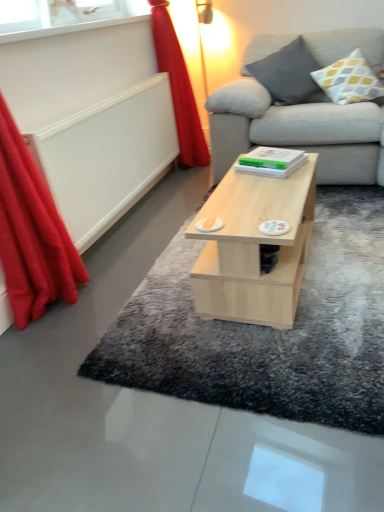
Identify the location of gray fabric pillow at upper right, the second pillow positioned from the right. (287, 73).

In order to click on transparent glass window at upper left in this screenshot , I will do `click(55, 13)`.

This screenshot has height=512, width=384. I want to click on red fabric curtain at left, which is the 1th curtain from front to back, so click(32, 233).

You are a GUI agent. You are given a task and a screenshot of the screen. Output one action in this format:
    pyautogui.click(x=<x>, y=<y>)
    Task: Click on the light gray shaggy rug at center
    This screenshot has height=512, width=384.
    Given the screenshot: What is the action you would take?
    pyautogui.click(x=267, y=330)

Describe the element at coordinates (178, 88) in the screenshot. This screenshot has height=512, width=384. I see `red velvet curtain at left, which ranks as the 2th curtain in left-to-right order` at that location.

This screenshot has height=512, width=384. Identify the location of yellow and gray dotted pillow at upper right, placed as the second pillow when sorted from left to right. (349, 80).

Which object is further away from the camera taking this photo, light wood coffee table at center or red fabric curtain at left, which ranks as the second curtain in back-to-front order?

light wood coffee table at center is more distant.

Is the surface of light wood coffee table at center in direct contact with red fabric curtain at left, which ranks as the second curtain in back-to-front order?

No, light wood coffee table at center is not next to red fabric curtain at left, which ranks as the second curtain in back-to-front order.

From the image's perspective, which curtain is the 1st one above the light wood coffee table at center? Please provide its 2D coordinates.

[(32, 233)]

Is light wood coffee table at center positioned with its back to red fabric curtain at left, placed as the first curtain when sorted from left to right?

That's not correct — light wood coffee table at center is not looking away from red fabric curtain at left, placed as the first curtain when sorted from left to right.

Is red fabric curtain at left, which ranks as the second curtain in back-to-front order, shorter than yellow and gray dotted pillow at upper right, acting as the 1th pillow starting from the right?

Incorrect, the height of red fabric curtain at left, which ranks as the second curtain in back-to-front order, does not fall short of that of yellow and gray dotted pillow at upper right, acting as the 1th pillow starting from the right.

Considering the relative sizes of red fabric curtain at left, which ranks as the 2th curtain in right-to-left order, and yellow and gray dotted pillow at upper right, placed as the second pillow when sorted from left to right, in the image provided, is red fabric curtain at left, which ranks as the 2th curtain in right-to-left order, smaller than yellow and gray dotted pillow at upper right, placed as the second pillow when sorted from left to right,?

No, red fabric curtain at left, which ranks as the 2th curtain in right-to-left order, is not smaller than yellow and gray dotted pillow at upper right, placed as the second pillow when sorted from left to right.

Based on their positions, is red fabric curtain at left, which is the 1th curtain from front to back, located to the left or right of yellow and gray dotted pillow at upper right, acting as the 1th pillow starting from the right?

In the image, red fabric curtain at left, which is the 1th curtain from front to back, appears on the left side of yellow and gray dotted pillow at upper right, acting as the 1th pillow starting from the right.

Considering the positions of objects red fabric curtain at left, which ranks as the 2th curtain in right-to-left order, and yellow and gray dotted pillow at upper right, placed as the second pillow when sorted from left to right, in the image provided, who is in front, red fabric curtain at left, which ranks as the 2th curtain in right-to-left order, or yellow and gray dotted pillow at upper right, placed as the second pillow when sorted from left to right,?

Positioned in front is red fabric curtain at left, which ranks as the 2th curtain in right-to-left order.

Does transparent glass window at upper left have a greater width compared to light wood coffee table at center?

No, transparent glass window at upper left is not wider than light wood coffee table at center.

Based on the photo, are transparent glass window at upper left and light wood coffee table at center located far from each other?

Yes.

Which object is positioned more to the right, transparent glass window at upper left or light wood coffee table at center?

light wood coffee table at center is more to the right.

The width and height of the screenshot is (384, 512). Identify the location of coffee table that appears on the right of transparent glass window at upper left. (254, 247).

Is the surface of yellow and gray dotted pillow at upper right, acting as the 1th pillow starting from the right, in direct contact with light gray shaggy rug at center?

No, yellow and gray dotted pillow at upper right, acting as the 1th pillow starting from the right, is not with light gray shaggy rug at center.

Which of these two, yellow and gray dotted pillow at upper right, acting as the 1th pillow starting from the right, or light gray shaggy rug at center, stands taller?

With more height is yellow and gray dotted pillow at upper right, acting as the 1th pillow starting from the right.

From a real-world perspective, relative to light gray shaggy rug at center, is yellow and gray dotted pillow at upper right, acting as the 1th pillow starting from the right, vertically above or below?

yellow and gray dotted pillow at upper right, acting as the 1th pillow starting from the right, is above light gray shaggy rug at center.

From the light gray shaggy rug at center, count 1st pillows backward and point to it. Please provide its 2D coordinates.

[(349, 80)]

Is light gray shaggy rug at center not close to gray fabric pillow at upper right, the second pillow positioned from the right?

Yes.

Which point is more forward, (x=184, y=333) or (x=287, y=56)?

The point (x=184, y=333) is closer to the camera.

Which object is closer to the camera taking this photo, light gray shaggy rug at center or gray fabric pillow at upper right, the first pillow in the left-to-right sequence?

light gray shaggy rug at center is in front.

How different are the orientations of light wood coffee table at center and gray fabric pillow at upper right, the first pillow in the left-to-right sequence, in degrees?

92 degrees.

Which is less distant, (308, 240) or (285, 102)?

Point (308, 240) appears to be closer to the viewer than point (285, 102).

Is light wood coffee table at center oriented towards gray fabric pillow at upper right, the second pillow positioned from the right?

No, light wood coffee table at center is not facing towards gray fabric pillow at upper right, the second pillow positioned from the right.

Looking at their sizes, would you say light wood coffee table at center is wider or thinner than gray fabric pillow at upper right, the first pillow in the left-to-right sequence?

In the image, light wood coffee table at center appears to be wider than gray fabric pillow at upper right, the first pillow in the left-to-right sequence.

How many degrees apart are the facing directions of yellow and gray dotted pillow at upper right, placed as the second pillow when sorted from left to right, and gray fabric pillow at upper right, the first pillow in the left-to-right sequence?

The angular difference between yellow and gray dotted pillow at upper right, placed as the second pillow when sorted from left to right, and gray fabric pillow at upper right, the first pillow in the left-to-right sequence, is 0.00108 degrees.

Is the position of yellow and gray dotted pillow at upper right, acting as the 1th pillow starting from the right, more distant than that of gray fabric pillow at upper right, the second pillow positioned from the right?

No, yellow and gray dotted pillow at upper right, acting as the 1th pillow starting from the right, is in front of gray fabric pillow at upper right, the second pillow positioned from the right.

Is yellow and gray dotted pillow at upper right, placed as the second pillow when sorted from left to right, touching gray fabric pillow at upper right, the first pillow in the left-to-right sequence?

No, yellow and gray dotted pillow at upper right, placed as the second pillow when sorted from left to right, is not with gray fabric pillow at upper right, the first pillow in the left-to-right sequence.

Between yellow and gray dotted pillow at upper right, acting as the 1th pillow starting from the right, and gray fabric pillow at upper right, the second pillow positioned from the right, which one has larger width?

gray fabric pillow at upper right, the second pillow positioned from the right.

Starting from the light wood coffee table at center, which curtain is the 2nd one to the left? Please provide its 2D coordinates.

[(32, 233)]

This screenshot has height=512, width=384. What are the coordinates of `curtain that is the 2nd one when counting downward from the yellow and gray dotted pillow at upper right, placed as the second pillow when sorted from left to right (from the image's perspective)` in the screenshot? It's located at (32, 233).

From the image, which object appears to be farther from gray fabric pillow at upper right, the second pillow positioned from the right, transparent glass window at upper left or light wood coffee table at center?

Based on the image, light wood coffee table at center appears to be further to gray fabric pillow at upper right, the second pillow positioned from the right.

Based on their spatial positions, is light wood coffee table at center or light gray shaggy rug at center further from red fabric curtain at left, which ranks as the second curtain in back-to-front order?

Based on the image, light wood coffee table at center appears to be further to red fabric curtain at left, which ranks as the second curtain in back-to-front order.

When comparing their distances from yellow and gray dotted pillow at upper right, acting as the 1th pillow starting from the right, does gray fabric pillow at upper right, the first pillow in the left-to-right sequence, or light wood coffee table at center seem closer?

gray fabric pillow at upper right, the first pillow in the left-to-right sequence, is positioned closer to the anchor yellow and gray dotted pillow at upper right, acting as the 1th pillow starting from the right.

When comparing their distances from yellow and gray dotted pillow at upper right, placed as the second pillow when sorted from left to right, does red fabric curtain at left, placed as the first curtain when sorted from left to right, or transparent glass window at upper left seem closer?

transparent glass window at upper left is closer to yellow and gray dotted pillow at upper right, placed as the second pillow when sorted from left to right.

Which object lies further to the anchor point gray fabric pillow at upper right, the first pillow in the left-to-right sequence, red fabric curtain at left, which is the 1th curtain from front to back, or yellow and gray dotted pillow at upper right, placed as the second pillow when sorted from left to right?

red fabric curtain at left, which is the 1th curtain from front to back, is further to gray fabric pillow at upper right, the first pillow in the left-to-right sequence.

Looking at the image, which one is located closer to gray fabric pillow at upper right, the first pillow in the left-to-right sequence, transparent glass window at upper left or red velvet curtain at left, which is counted as the second curtain, starting from the front?

The object closer to gray fabric pillow at upper right, the first pillow in the left-to-right sequence, is red velvet curtain at left, which is counted as the second curtain, starting from the front.

When comparing their distances from yellow and gray dotted pillow at upper right, placed as the second pillow when sorted from left to right, does transparent glass window at upper left or gray fabric pillow at upper right, the first pillow in the left-to-right sequence, seem further?

Among the two, transparent glass window at upper left is located further to yellow and gray dotted pillow at upper right, placed as the second pillow when sorted from left to right.

Which object lies nearer to the anchor point light wood coffee table at center, red velvet curtain at left, which ranks as the 2th curtain in left-to-right order, or yellow and gray dotted pillow at upper right, placed as the second pillow when sorted from left to right?

The object closer to light wood coffee table at center is yellow and gray dotted pillow at upper right, placed as the second pillow when sorted from left to right.

The height and width of the screenshot is (512, 384). I want to click on coffee table between light gray shaggy rug at center and gray fabric pillow at upper right, the second pillow positioned from the right, from front to back, so click(254, 247).

The image size is (384, 512). What are the coordinates of `coffee table between transparent glass window at upper left and light gray shaggy rug at center from top to bottom` in the screenshot? It's located at (254, 247).

In order to click on pillow between light wood coffee table at center and gray fabric pillow at upper right, the second pillow positioned from the right, in the front-back direction in this screenshot , I will do `click(349, 80)`.

This screenshot has height=512, width=384. I want to click on pillow between red velvet curtain at left, which is the 1th curtain from back to front, and yellow and gray dotted pillow at upper right, placed as the second pillow when sorted from left to right, from left to right, so click(287, 73).